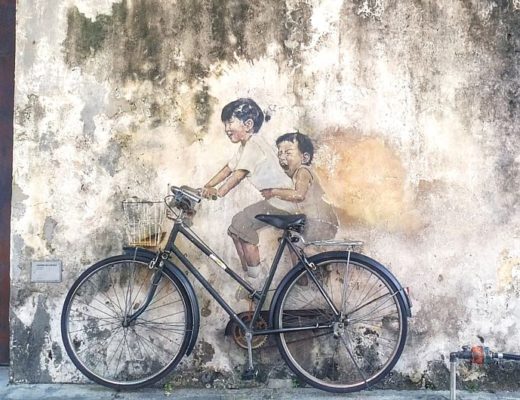
Identify the location of wall. (282, 87).